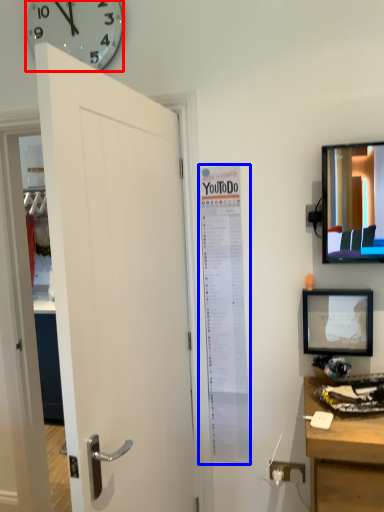
Question: Among these objects, which one is nearest to the camera, wall clock (highlighted by a red box) or poster page (highlighted by a blue box)?

Choices:
 (A) wall clock
 (B) poster page

Answer: (A)